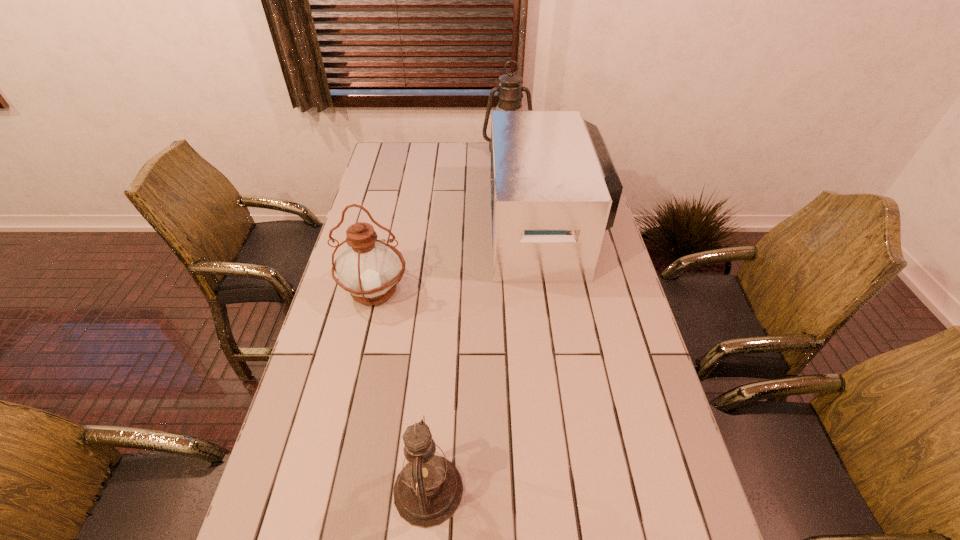
Find the location of a particular element. the tallest object is located at coordinates (510, 89).

Identify the location of the rightmost oil lamp. This screenshot has width=960, height=540. (510, 89).

The height and width of the screenshot is (540, 960). Identify the location of the leftmost object. (368, 268).

You are a GUI agent. You are given a task and a screenshot of the screen. Output one action in this format:
    pyautogui.click(x=<x>, y=<y>)
    Task: Click on the leftmost oil lamp
    The image size is (960, 540).
    Given the screenshot: What is the action you would take?
    pyautogui.click(x=368, y=268)

You are a GUI agent. You are given a task and a screenshot of the screen. Output one action in this format:
    pyautogui.click(x=<x>, y=<y>)
    Task: Click on the microwave oven
    
    Given the screenshot: What is the action you would take?
    pyautogui.click(x=554, y=188)

Locate an element on the screen. the nearest object is located at coordinates (428, 490).

What are the coordinates of `the nearest oil lamp` in the screenshot? It's located at (428, 490).

Where is `free region located 0.240m on the left of the rightmost oil lamp`? The width and height of the screenshot is (960, 540). free region located 0.240m on the left of the rightmost oil lamp is located at coordinates (428, 151).

This screenshot has height=540, width=960. Find the location of `free space located on the front of the leftmost oil lamp`. free space located on the front of the leftmost oil lamp is located at coordinates (355, 374).

Identify the location of vacant space located 0.370m on the front-facing side of the microwave oven. (388, 227).